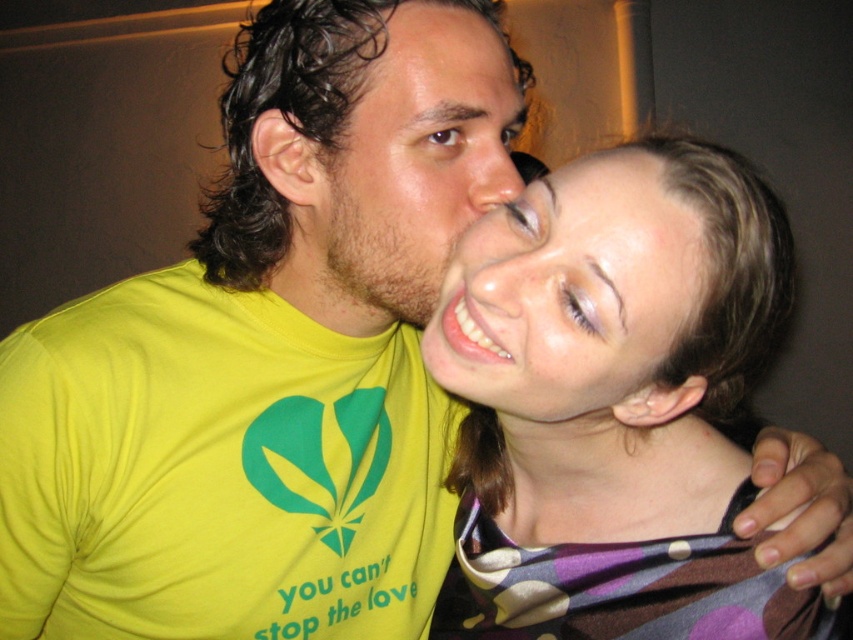
Can you confirm if multicolored fabric scarf at center is positioned to the right of brown matte skin at center?

Correct, you'll find multicolored fabric scarf at center to the right of brown matte skin at center.

Which is in front, point (595, 326) or point (434, 266)?

Positioned in front is point (595, 326).

Is point (592, 324) closer to camera compared to point (439, 188)?

Yes, point (592, 324) is in front of point (439, 188).

Locate an element on the screen. The width and height of the screenshot is (853, 640). multicolored fabric scarf at center is located at coordinates (614, 403).

Does smooth skin face at center have a greater width compared to brown matte skin at center?

No, smooth skin face at center is not wider than brown matte skin at center.

Can you confirm if smooth skin face at center is positioned below brown matte skin at center?

Yes.

Is point (573, 192) in front of point (341, 291)?

Yes, point (573, 192) is closer to viewer.

The height and width of the screenshot is (640, 853). Find the location of `smooth skin face at center`. smooth skin face at center is located at coordinates (573, 298).

Who is taller, multicolored fabric scarf at center or smooth skin face at center?

Standing taller between the two is multicolored fabric scarf at center.

Which is more to the left, multicolored fabric scarf at center or smooth skin face at center?

From the viewer's perspective, smooth skin face at center appears more on the left side.

Which is in front, point (445, 364) or point (515, 412)?

Point (445, 364) is more forward.

I want to click on multicolored fabric scarf at center, so click(x=614, y=403).